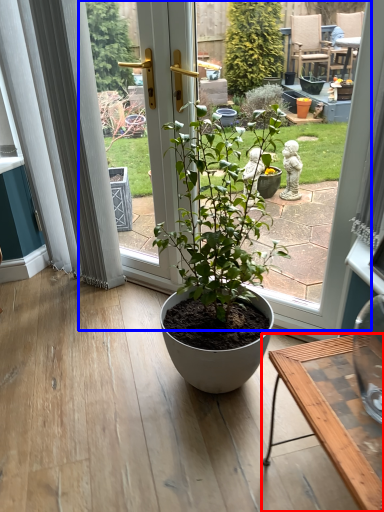
Question: Among these objects, which one is nearest to the camera, desk (highlighted by a red box) or bay window (highlighted by a blue box)?

Choices:
 (A) desk
 (B) bay window

Answer: (A)